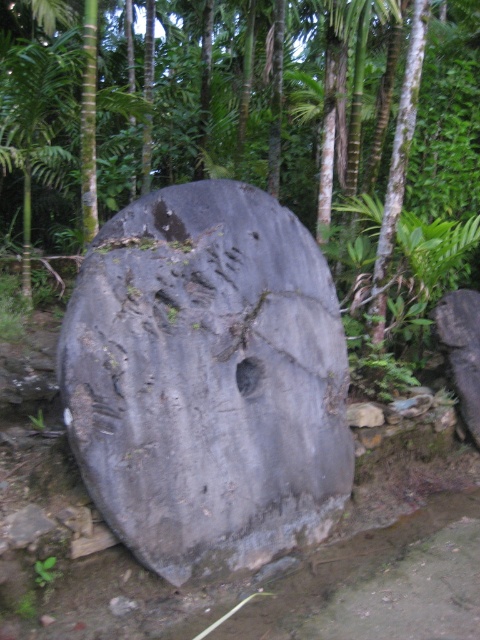
You are standing in a tropical garden and see the gray stone wheel at center. If you walk directly towards the stone wheel, will you first encounter any obstacles based on its position coordinates?

The gray stone wheel at center is located at point (263,134), so there are no obstacles in your path as it is centrally positioned.